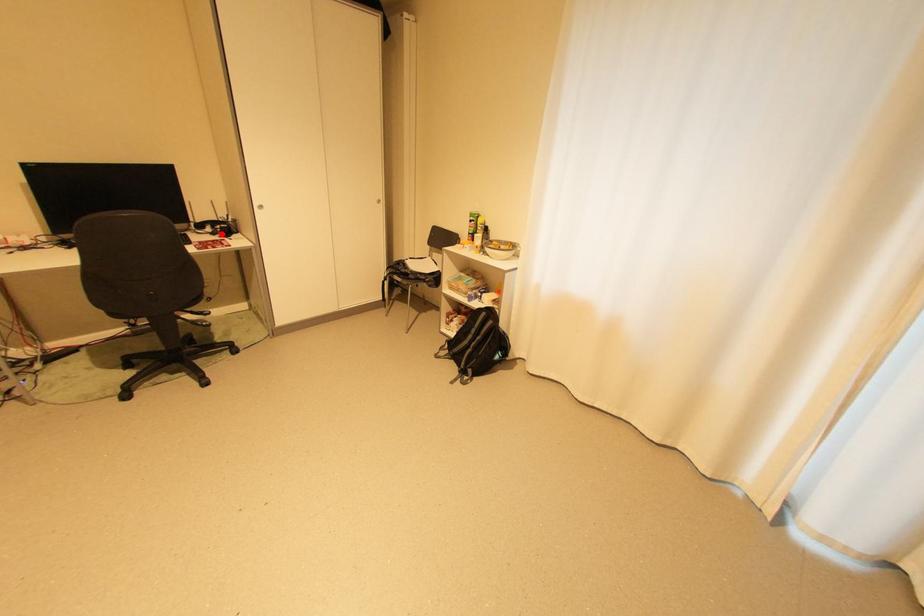
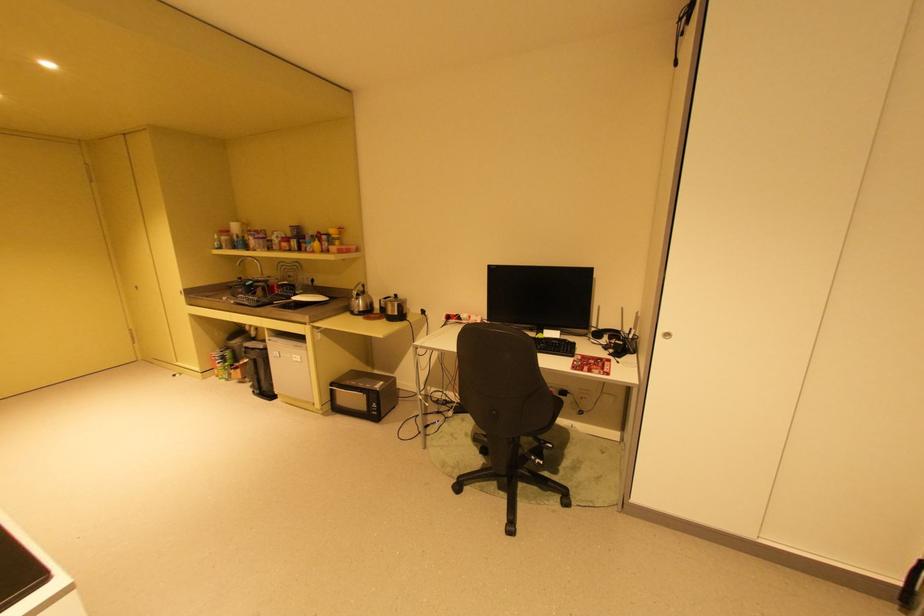
Question: I am providing you with two images of the same scene from different viewpoints. A red point is marked on the first image. Can you still see the location of the red point in image 2?

Choices:
 (A) Yes
 (B) No

Answer: (A)